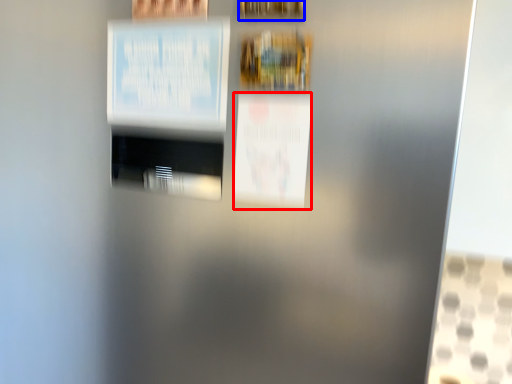
Question: Which of the following is the closest to the observer, poster (highlighted by a red box) or picture frame (highlighted by a blue box)?

Choices:
 (A) poster
 (B) picture frame

Answer: (B)